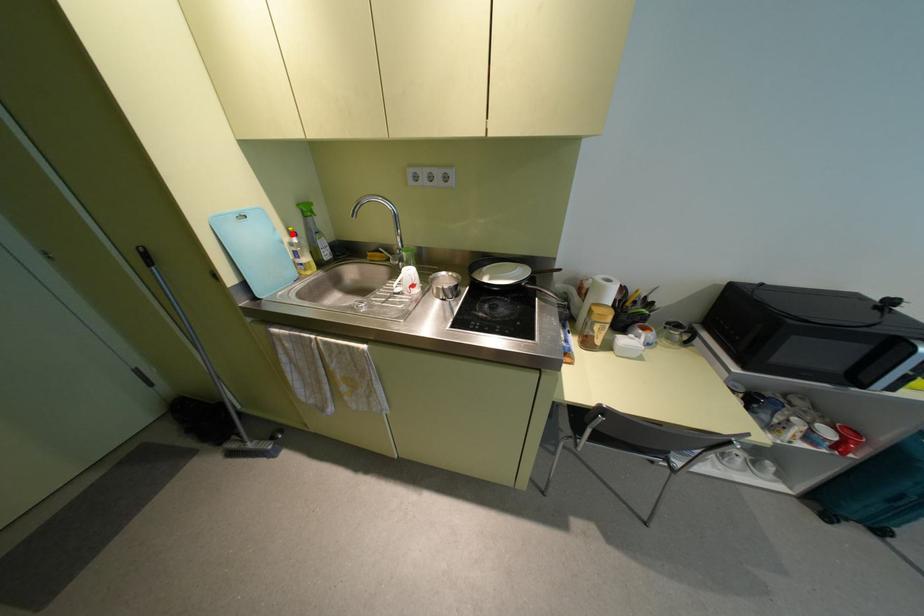
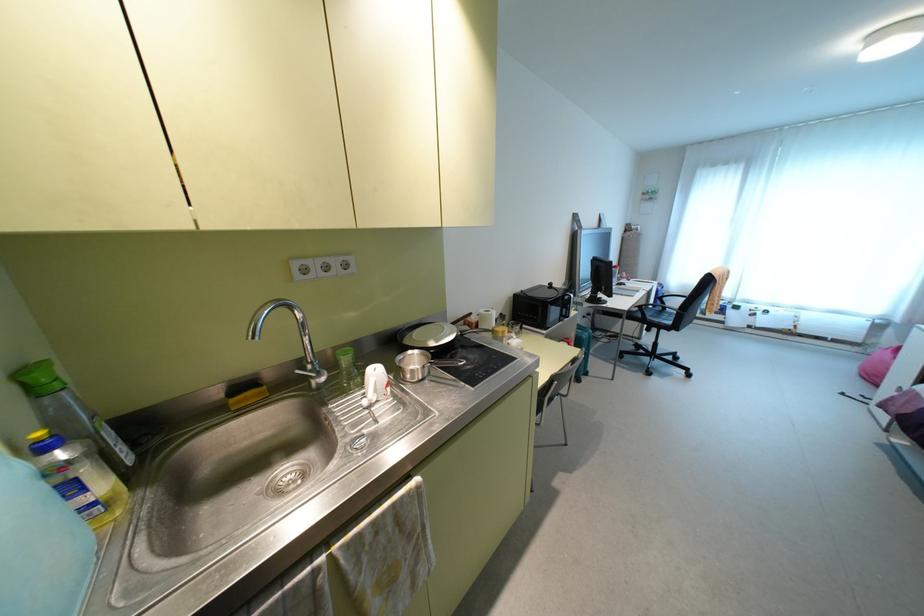
Question: I am providing you with two images of the same scene from different viewpoints. A red point is shown in image1. For the corresponding object point in image2, is it positioned nearer or farther from the camera?

Choices:
 (A) Nearer
 (B) Farther

Answer: (B)